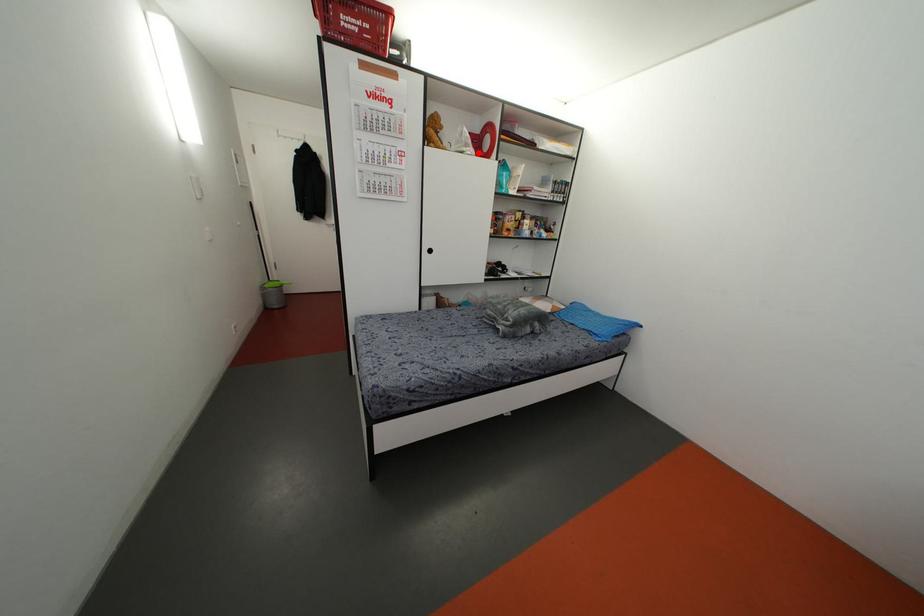
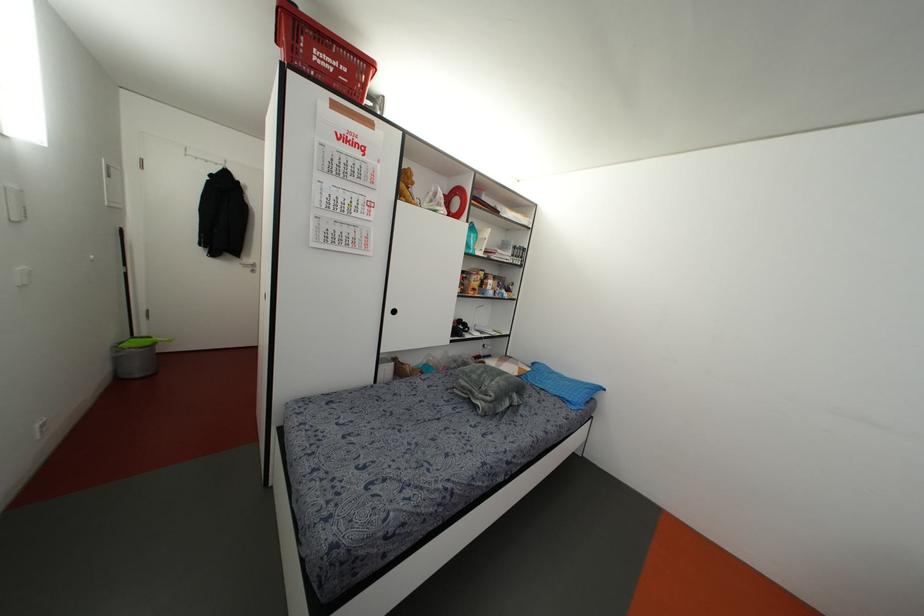
Question: I am providing you with two images of the same scene from different viewpoints. A red point is shown in image1. For the corresponding object point in image2, is it positioned nearer or farther from the camera?

Choices:
 (A) Nearer
 (B) Farther

Answer: (B)